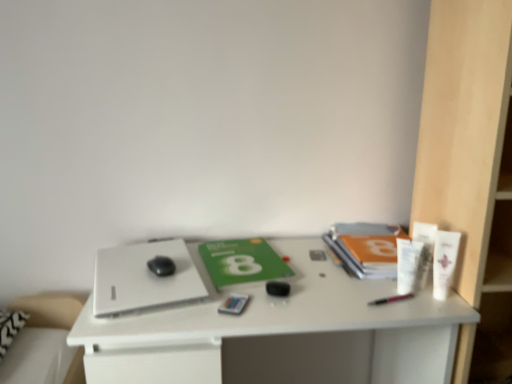
At what (x,y) coordinates should I click in order to perform the action: click on vacant space in between matte plastic card at center, which appears as the first stationery when viewed from the left, and white plastic tube at right, the third toiletry positioned from the right. Please return your answer as a coordinate pair (x, y). Looking at the image, I should click on (317, 300).